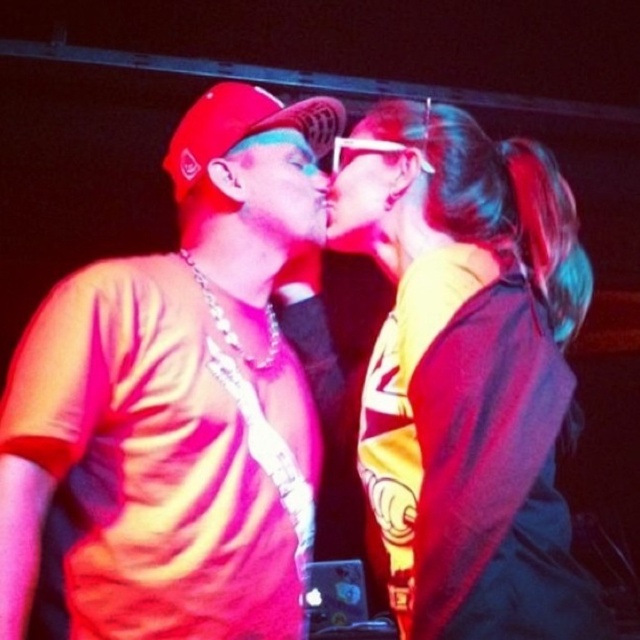
Question: Which of these objects is positioned farthest from the matte plastic face at center?

Choices:
 (A) matte black face at center
 (B) yellow fabric at center
 (C) matte red cap at center

Answer: (C)

Question: Among these objects, which one is farthest from the camera?

Choices:
 (A) matte red cap at center
 (B) yellow fabric at center
 (C) matte plastic face at center

Answer: (C)

Question: Is yellow fabric at center positioned behind matte black face at center?

Choices:
 (A) yes
 (B) no

Answer: (B)

Question: Does matte red cap at center have a larger size compared to yellow fabric at center?

Choices:
 (A) no
 (B) yes

Answer: (B)

Question: Based on their relative distances, which object is farther from the yellow fabric at center?

Choices:
 (A) matte plastic face at center
 (B) matte black face at center

Answer: (B)

Question: Is yellow fabric at center thinner than matte plastic face at center?

Choices:
 (A) yes
 (B) no

Answer: (B)